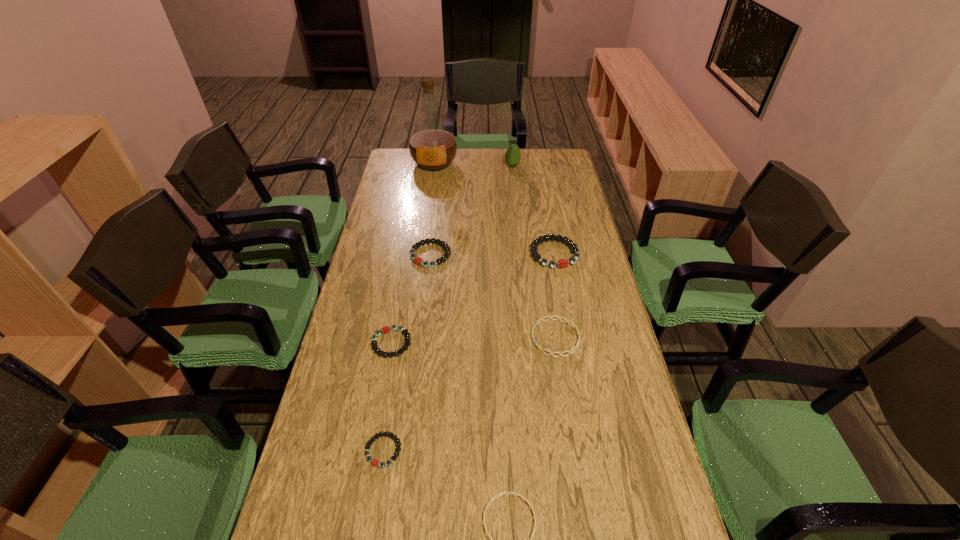
The height and width of the screenshot is (540, 960). Identify the location of liquor. (432, 145).

The height and width of the screenshot is (540, 960). What are the coordinates of `pink liquor` in the screenshot? It's located at (432, 145).

The image size is (960, 540). Find the location of `the seventh shortest object`. the seventh shortest object is located at coordinates (512, 156).

Identify the location of avocado. Image resolution: width=960 pixels, height=540 pixels. (512, 156).

Find the location of a particular element. The height and width of the screenshot is (540, 960). the tallest bracelet is located at coordinates (560, 263).

The width and height of the screenshot is (960, 540). Find the location of `the rightmost black bracelet`. the rightmost black bracelet is located at coordinates (560, 263).

This screenshot has height=540, width=960. Identify the location of the second biggest black bracelet. coord(419,261).

The height and width of the screenshot is (540, 960). I want to click on the second tallest bracelet, so click(x=419, y=261).

Find the location of a particular element. The width and height of the screenshot is (960, 540). the right blue bracelet is located at coordinates (559, 318).

This screenshot has width=960, height=540. I want to click on the farther blue bracelet, so click(x=559, y=318).